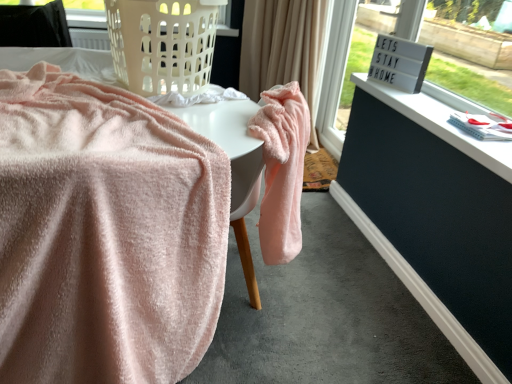
This screenshot has width=512, height=384. I want to click on vacant region to the right of velvet pink table at center, which is the 1th table from right to left, so click(326, 296).